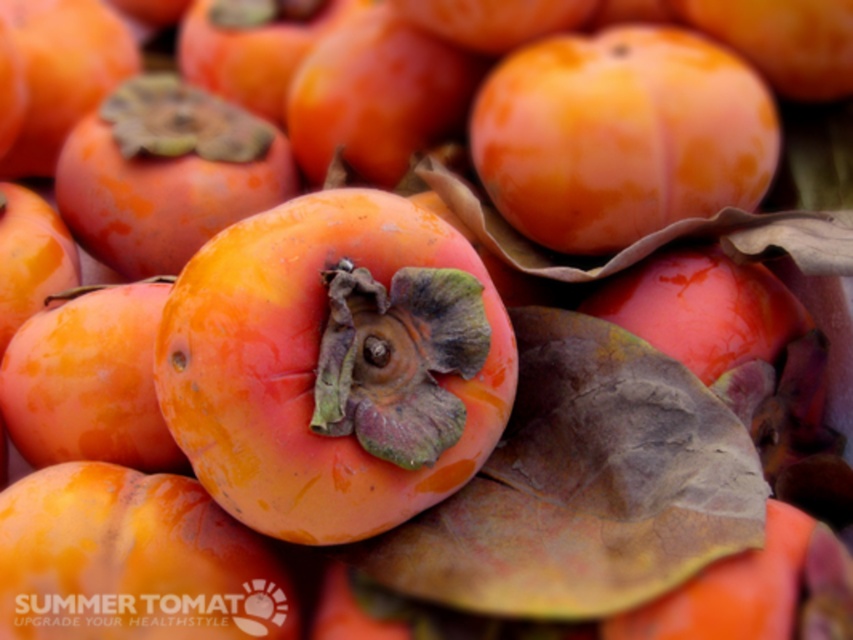
You are a fruit vendor arranging fruits on a shelf. You have a glossy orange persimmon at center and a matte orange apricot at center. Which fruit is thinner?

The glossy orange persimmon at center is thinner than the matte orange apricot at center.

You are a fruit seller who needs to arrange these fruits in a display. The store has a rule that fruits must be spaced at least 12 inches apart for visibility. Can the glossy orange persimmon at center and the matte orange apricot at center be placed together in this display?

The distance between the glossy orange persimmon at center and the matte orange apricot at center is 13.45 inches, which exceeds the minimum requirement of 12 inches. Therefore, they can be placed together in the display.

You are arranging fruits in a display and need to place a glossy orange persimmon at center and a matte orange apricot at center. According to the image, which fruit is positioned to the left?

The glossy orange persimmon at center is to the left of the matte orange apricot at center.